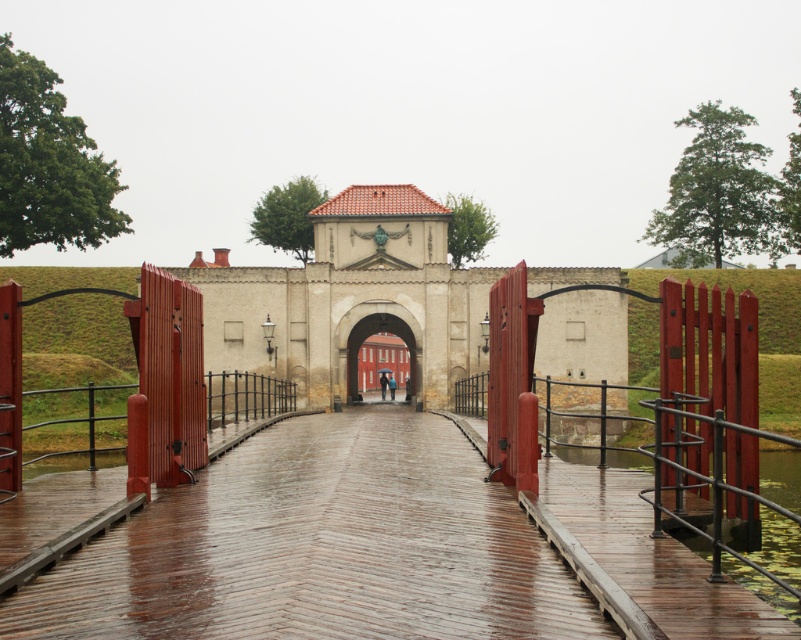
Is wet wooden bridge at center smaller than red wooden gate at center?

Indeed, wet wooden bridge at center has a smaller size compared to red wooden gate at center.

Who is taller, wet wooden bridge at center or red wooden gate at center?

Standing taller between the two is red wooden gate at center.

Which is behind, point (133, 612) or point (411, 348)?

The point (411, 348) is more distant.

The width and height of the screenshot is (801, 640). I want to click on wet wooden bridge at center, so click(x=320, y=547).